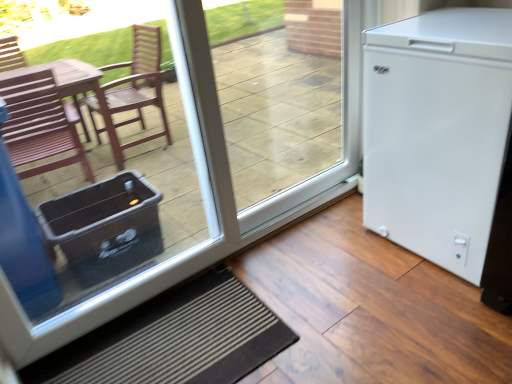
Question: From a real-world perspective, is transparent glass door at center physically located above or below white matte refrigerator at right?

Choices:
 (A) above
 (B) below

Answer: (A)

Question: Is point (343, 97) positioned closer to the camera than point (17, 355)?

Choices:
 (A) farther
 (B) closer

Answer: (A)

Question: Which of these objects is positioned farthest from the black textured mat at lower center?

Choices:
 (A) white matte refrigerator at right
 (B) transparent glass door at center
 (C) white matte refrigerator at right

Answer: (B)

Question: Which of these objects is positioned farthest from the black textured mat at lower center?

Choices:
 (A) transparent glass door at center
 (B) white matte refrigerator at right
 (C) white matte refrigerator at right

Answer: (A)